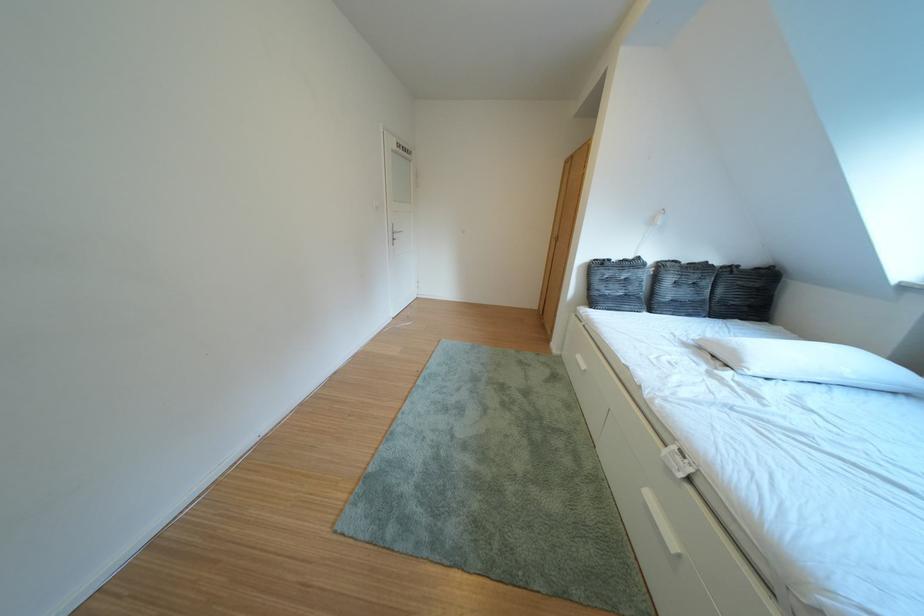
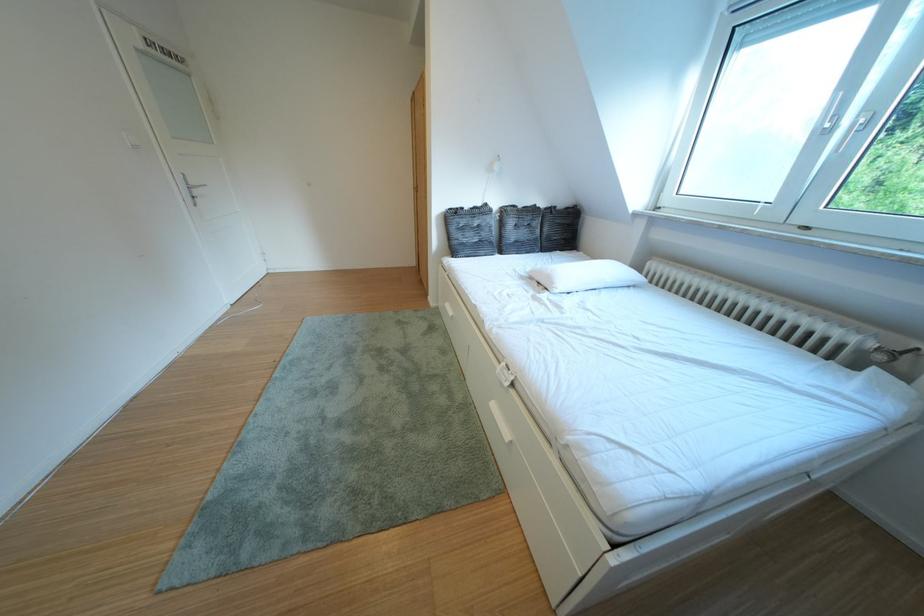
Find the pixel in the second image that matches [592,362] in the first image.

(460, 310)